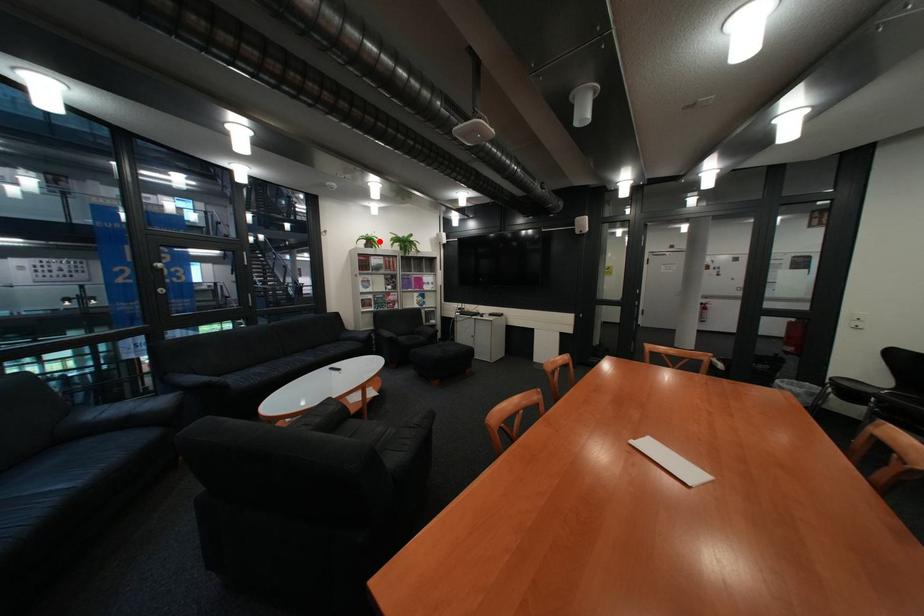
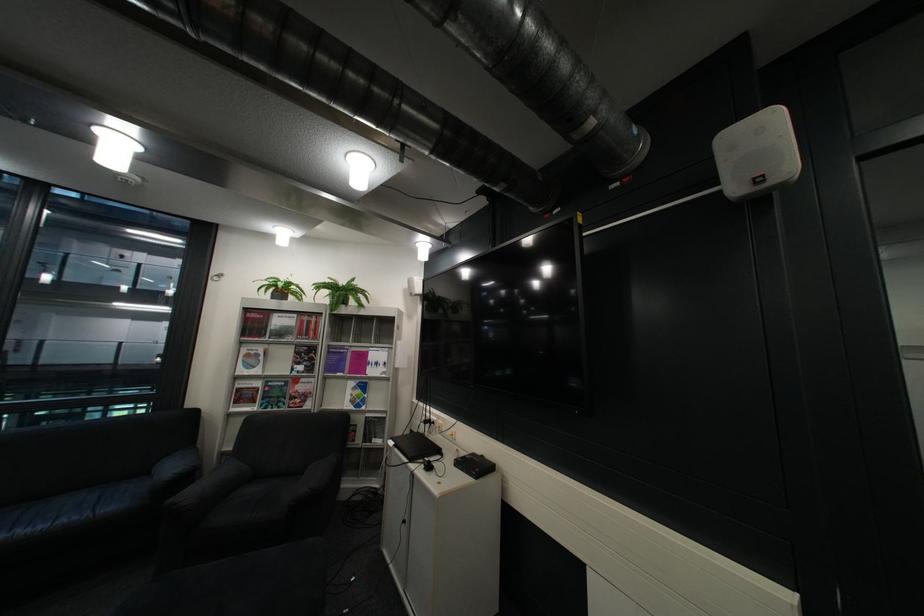
Find the pixel in the second image that matches the highlighted location in the first image.

(287, 290)